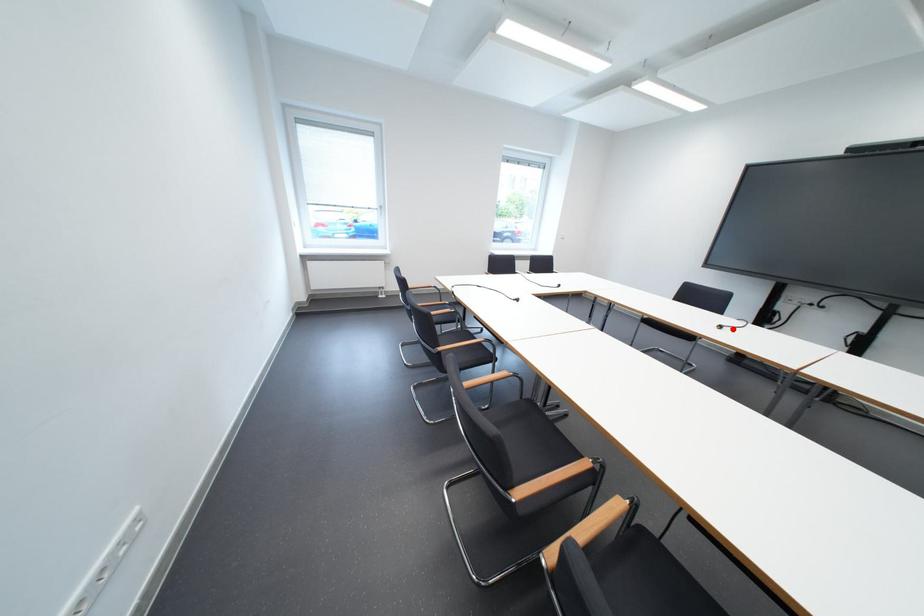
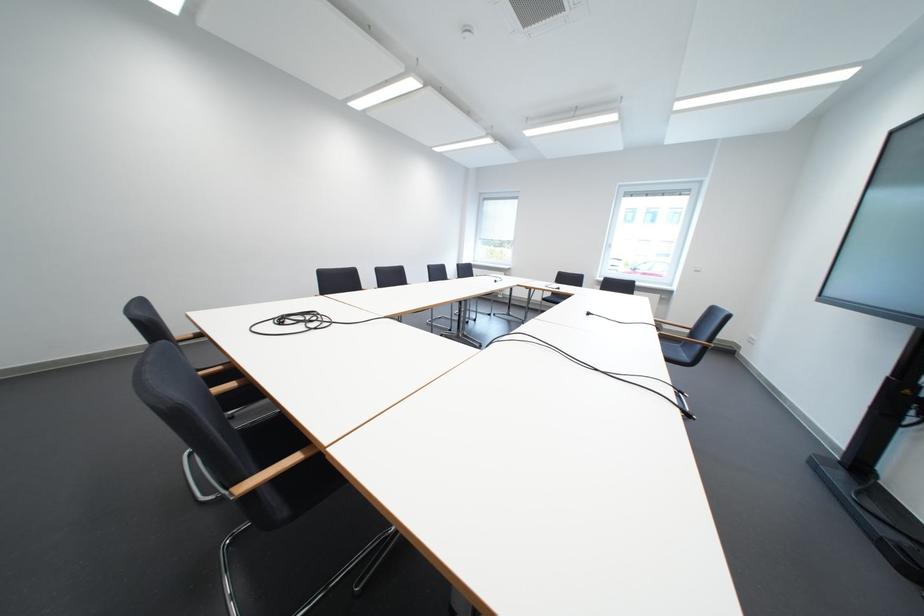
The point at the highlighted location is marked in the first image. Where is the corresponding point in the second image?

(601, 315)